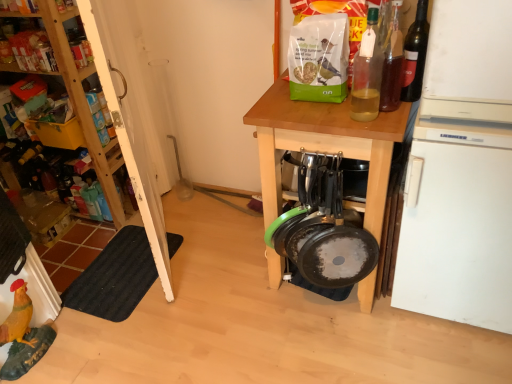
Where is `vacant space in front of wooden table at center`? vacant space in front of wooden table at center is located at coordinates (345, 348).